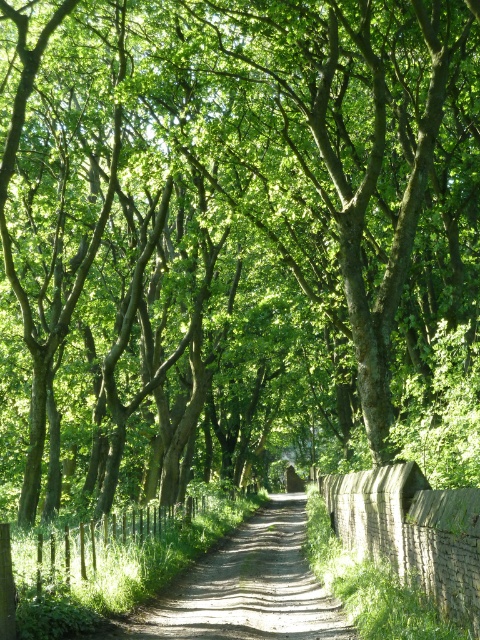
Question: Can you confirm if dirt/gravel path at center is positioned below brick wall at right?

Choices:
 (A) yes
 (B) no

Answer: (A)

Question: Which point is closer to the camera?

Choices:
 (A) dirt/gravel path at center
 (B) brick wall at right

Answer: (B)

Question: Which of the following is the farthest from the observer?

Choices:
 (A) dirt/gravel path at center
 (B) brick wall at right

Answer: (A)

Question: Is dirt/gravel path at center positioned before brick wall at right?

Choices:
 (A) yes
 (B) no

Answer: (B)

Question: Can you confirm if dirt/gravel path at center is positioned below brick wall at right?

Choices:
 (A) yes
 (B) no

Answer: (A)